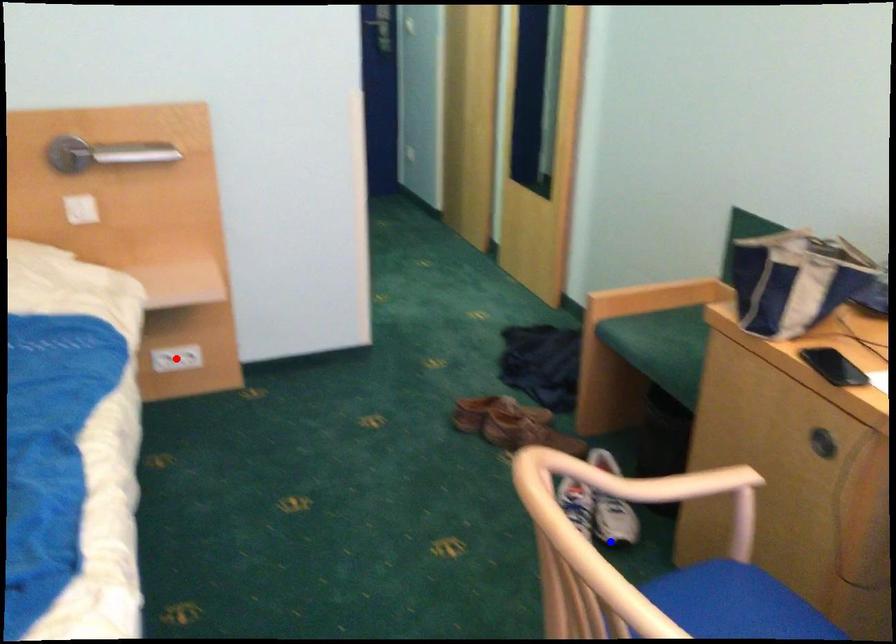
Question: Two points are marked on the image. Which point is closer to the camera?

Choices:
 (A) Blue point is closer.
 (B) Red point is closer.

Answer: (A)